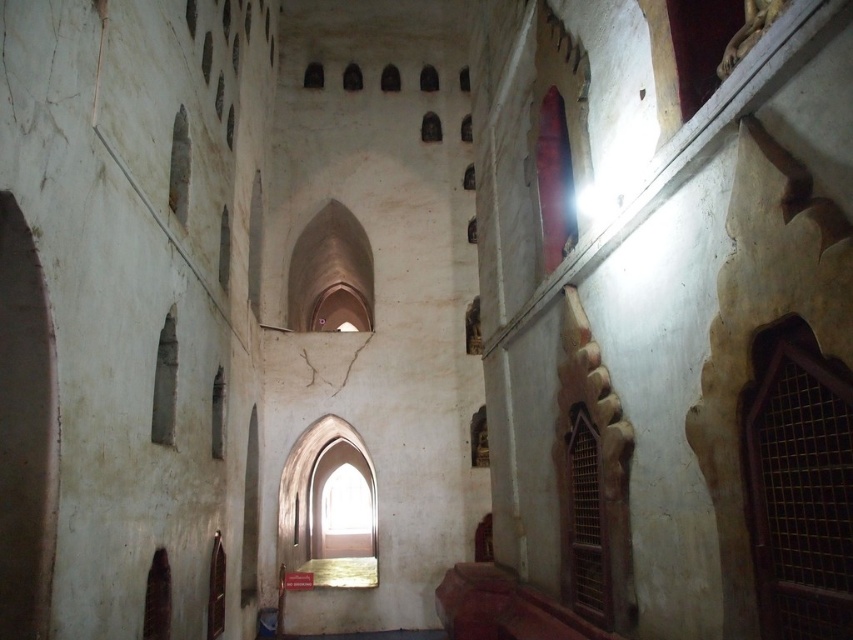
You are standing inside the historic building and want to look outside through both windows. Which window, the smooth dark wood window at upper center or the transparent glass window at center, is easier to see through?

The transparent glass window at center is easier to see through because it is made of transparent glass, while the smooth dark wood window at upper center is likely opaque. However, the smooth dark wood window at upper center is closer to the viewer, but transparency is more important for visibility.